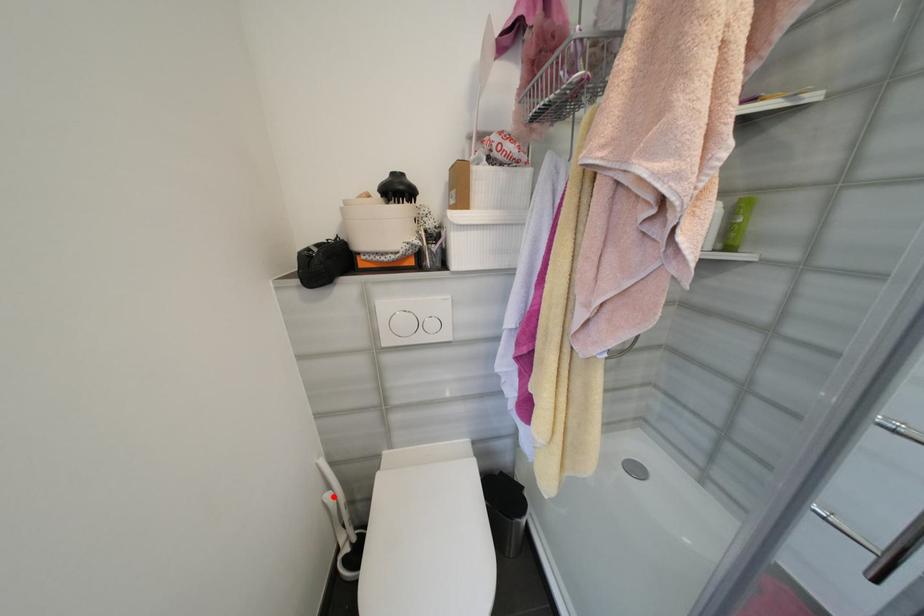
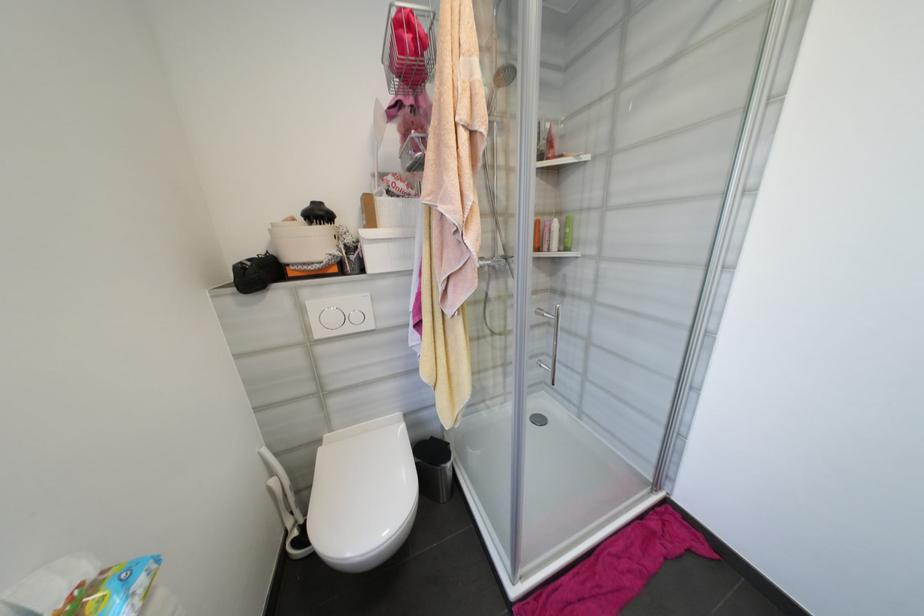
Question: I am providing you with two images of the same scene from different viewpoints. A red point is marked on the first image. At the location where the point appears in image 1, is it still visible in image 2?

Choices:
 (A) Yes
 (B) No

Answer: (A)